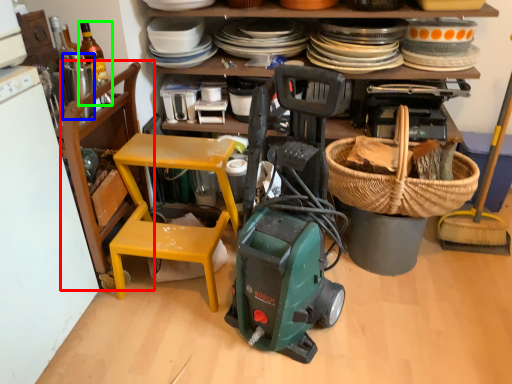
Question: Which object is the farthest from chair (highlighted by a red box)? Choose among these: appliance (highlighted by a blue box) or bottle (highlighted by a green box).

Choices:
 (A) appliance
 (B) bottle

Answer: (A)